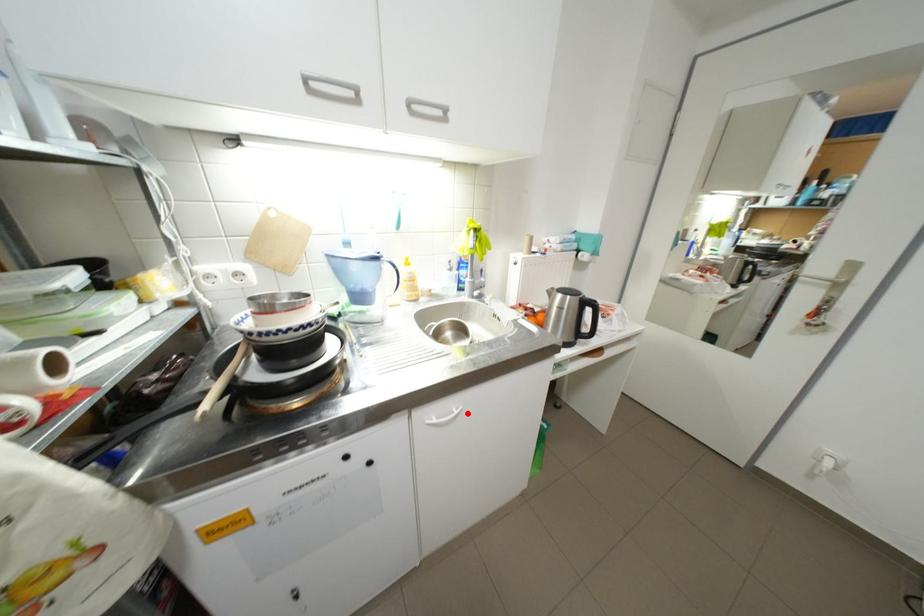
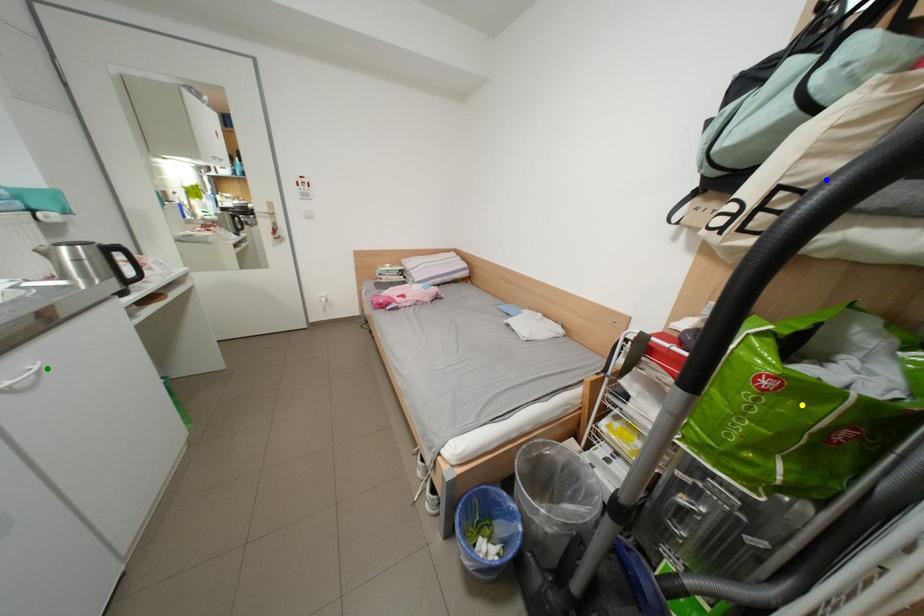
Question: I am providing you with two images of the same scene from different viewpoints. A red point is marked on the first image. You are given multiple points on the second image. Which mark in image 2 goes with the point in image 1?

Choices:
 (A) yellow point
 (B) blue point
 (C) green point

Answer: (C)